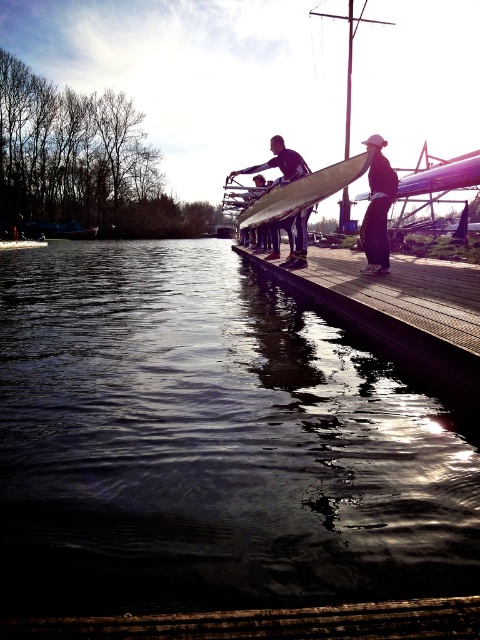
You are standing on the wooden dock at center and want to place the black matte surfboard at center somewhere. Where should you put it so that it doesn

The wooden dock at center is positioned under the black matte surfboard at center, so you should place the black matte surfboard at center on top of the wooden dock at center.

You are standing on the wooden dock and want to place a small item exactly halfway between point (345, 186) and point (376, 161). Which direction should you move from the closer point to reach the midpoint?

You should move towards the direction of point (345, 186) from point (376, 161) to reach the midpoint since point (345, 186) is closer to the camera and the midpoint would be between them.

You are planning to cross the river using a small raft that is 1.2 meters wide. The dark reflective water at center and the wooden dock at center are in your path. Based on their widths, can your raft fit through the space between them?

The dark reflective water at center has a larger width than the wooden dock at center. Since the raft is 1.2 meters wide, it can fit through the space between them as the dock is narrower than the water area.